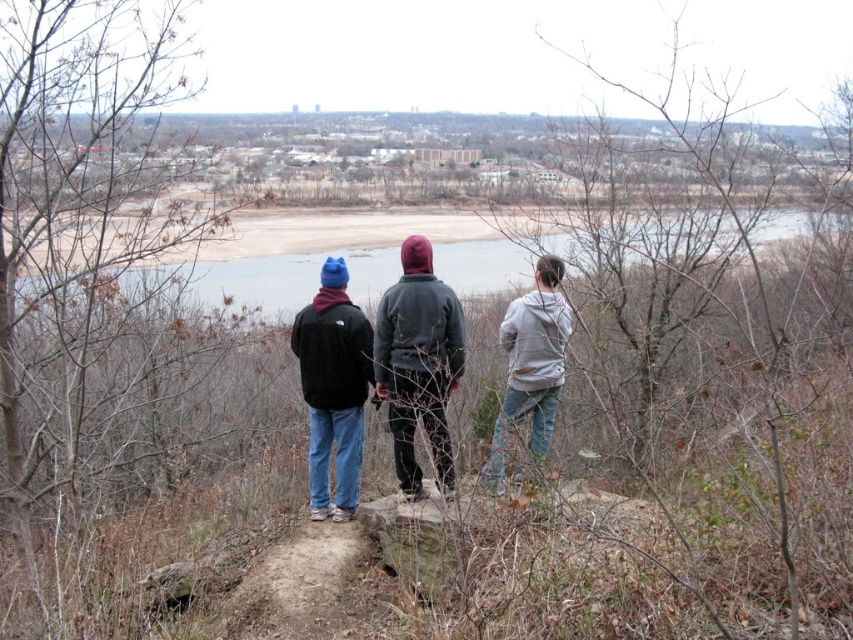
You are a photographer trying to capture a group photo of the matte black jacket at center and the gray fleece jacket at center. Since you want to ensure both subjects are in focus, you need to know their height difference. Which of the two is taller?

The matte black jacket at center is taller than the gray fleece jacket at center.

You are standing at the center of the rocky outcrop and want to hand a map to the person wearing the dark gray hoodie at center. Which direction should you move to reach them?

The dark gray hoodie at center is located at point (418, 362), so you should move towards the center of the rocky outcrop to reach them.